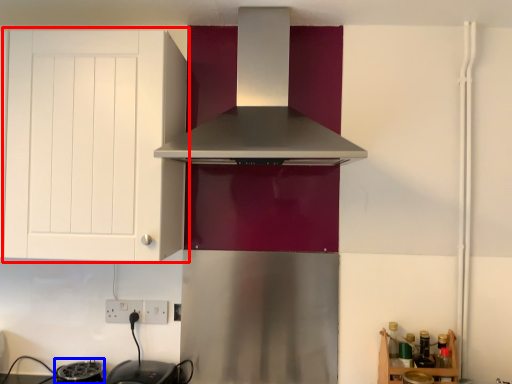
Question: Among these objects, which one is farthest to the camera, cabinetry (highlighted by a red box) or appliance (highlighted by a blue box)?

Choices:
 (A) cabinetry
 (B) appliance

Answer: (B)